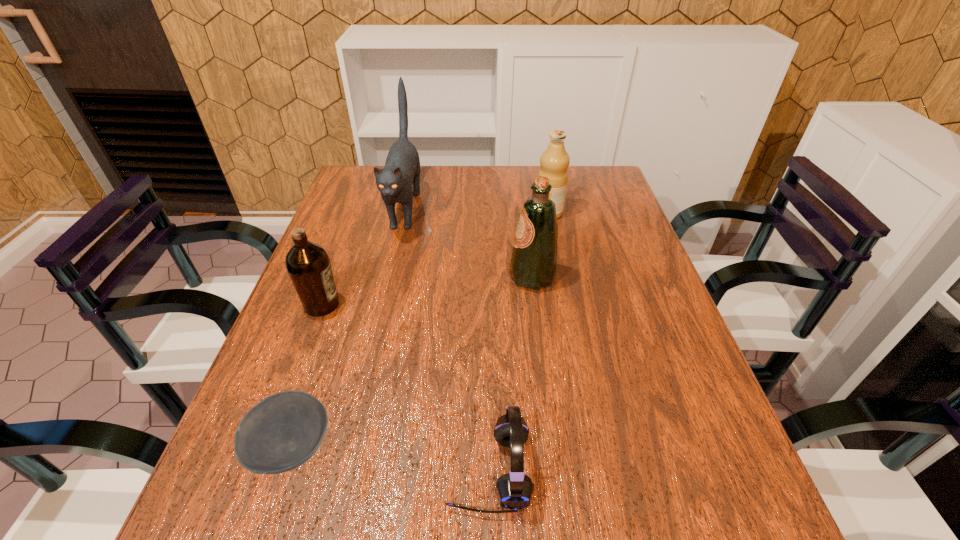
At what (x,y) coordinates should I click in order to perform the action: click on cat. Please return your answer as a coordinate pair (x, y). The width and height of the screenshot is (960, 540). Looking at the image, I should click on (399, 180).

I want to click on the farthest olive oil, so click(x=554, y=161).

Where is `the fourth tallest object`? Image resolution: width=960 pixels, height=540 pixels. the fourth tallest object is located at coordinates (308, 264).

At what (x,y) coordinates should I click in order to perform the action: click on the shortest olive oil. Please return your answer as a coordinate pair (x, y). Looking at the image, I should click on (308, 264).

You are a GUI agent. You are given a task and a screenshot of the screen. Output one action in this format:
    pyautogui.click(x=<x>, y=<y>)
    Task: Click on the fifth tallest object
    
    Given the screenshot: What is the action you would take?
    pyautogui.click(x=514, y=490)

Identify the location of bowl. Image resolution: width=960 pixels, height=540 pixels. coord(283,431).

Find the location of a particular element. Image resolution: width=960 pixels, height=540 pixels. vacant space located at the face of the cat is located at coordinates (392, 265).

Locate an element on the screen. The width and height of the screenshot is (960, 540). vacant space located on the label of the farthest olive oil is located at coordinates (425, 213).

Where is `free location located 0.260m on the label of the farthest olive oil`? free location located 0.260m on the label of the farthest olive oil is located at coordinates (448, 213).

I want to click on free space located 0.210m on the label of the farthest olive oil, so click(x=465, y=213).